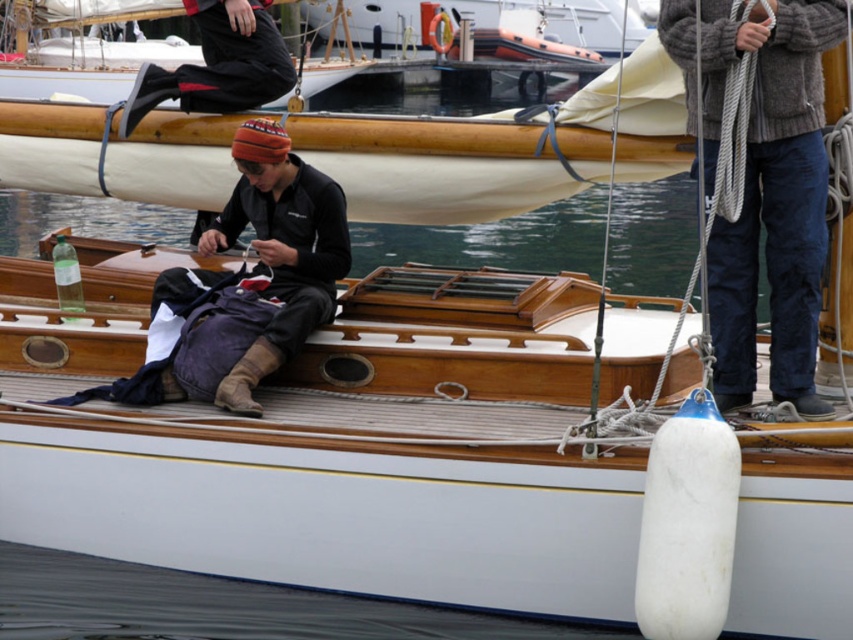
Does knitted wool sweater at upper right lie behind dark blue fabric backpack at center?

No, knitted wool sweater at upper right is closer to the viewer.

Does knitted wool sweater at upper right appear on the left side of dark blue fabric backpack at center?

No, knitted wool sweater at upper right is not to the left of dark blue fabric backpack at center.

You are a GUI agent. You are given a task and a screenshot of the screen. Output one action in this format:
    pyautogui.click(x=<x>, y=<y>)
    Task: Click on the knitted wool sweater at upper right
    
    Given the screenshot: What is the action you would take?
    pyautogui.click(x=769, y=196)